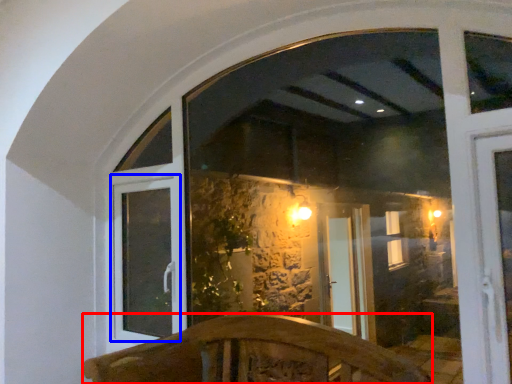
Question: Which object is further to the camera taking this photo, furniture (highlighted by a red box) or window frame (highlighted by a blue box)?

Choices:
 (A) furniture
 (B) window frame

Answer: (B)